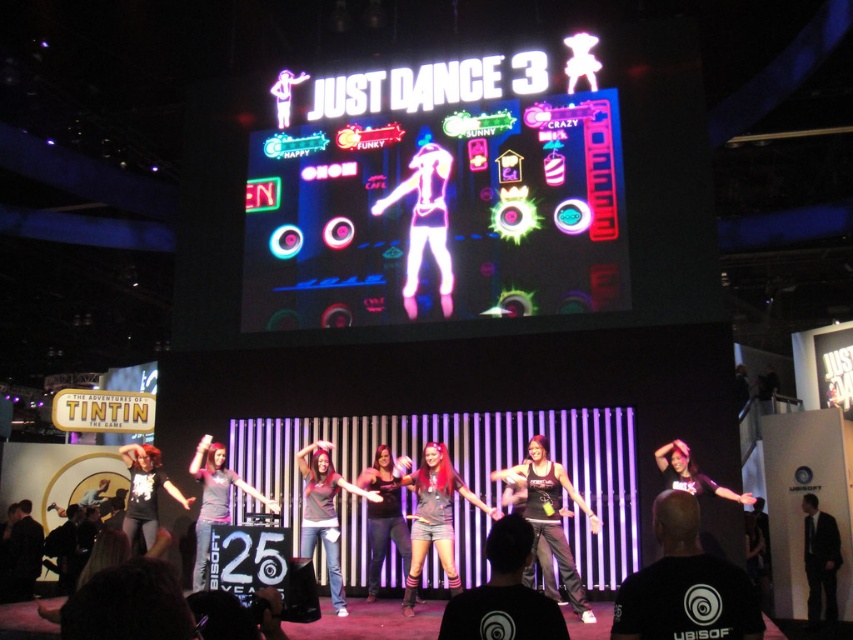
Question: Does matte black shirt at center appear over black t-shirt at left?

Choices:
 (A) no
 (B) yes

Answer: (B)

Question: Among these objects, which one is farthest from the camera?

Choices:
 (A) black t-shirt at left
 (B) neon pink holographic dancer at center
 (C) dark gray fabric shirt at center
 (D) matte black shirt at center

Answer: (B)

Question: Which point is closer to the camera taking this photo?

Choices:
 (A) tap(311, 547)
 (B) tap(430, 468)

Answer: (B)

Question: Estimate the real-world distances between objects in this image. Which object is farther from the black fabric tank top at center?

Choices:
 (A) black t-shirt at left
 (B) neon pink holographic dancer at center
 (C) dark gray fabric shirt at center

Answer: (A)

Question: Does neon plastic scoreboard at upper center have a greater width compared to shiny black tank top at center?

Choices:
 (A) yes
 (B) no

Answer: (A)

Question: Can you confirm if dark gray fabric shirt at center is positioned to the right of gray matte shirt at center?

Choices:
 (A) yes
 (B) no

Answer: (A)